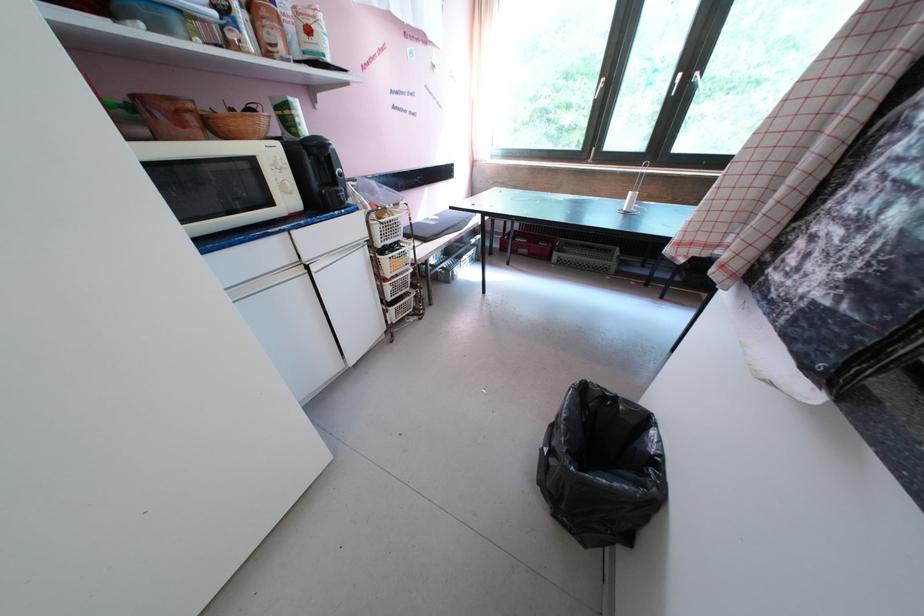
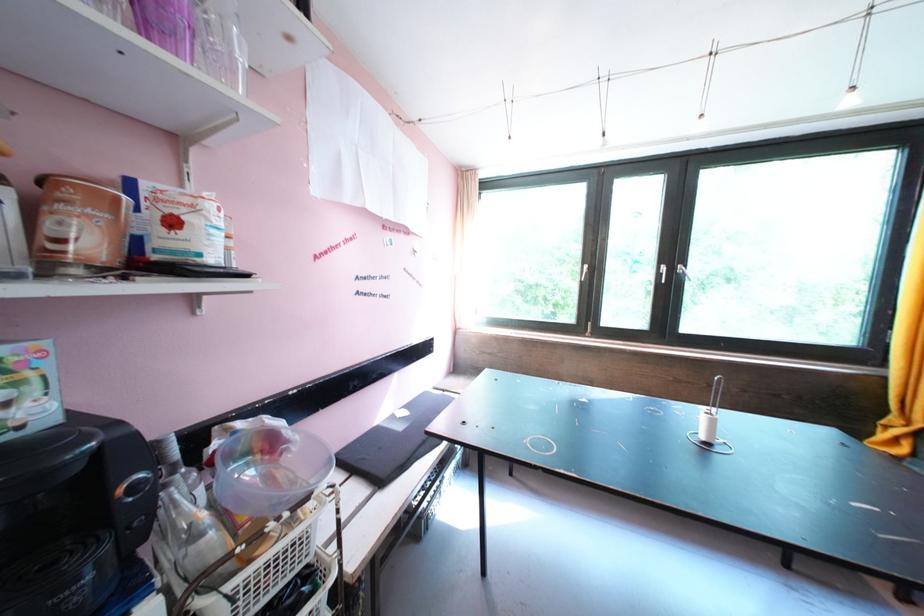
Locate, in the second image, the point that corresponds to [696,82] in the first image.

(679, 273)